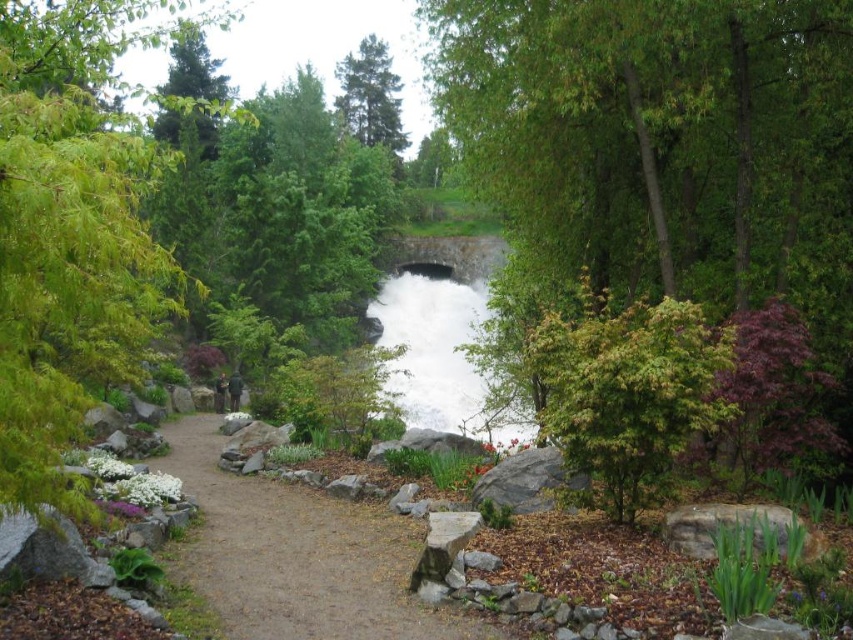
Does brown dirt path at center appear on the right side of green matte tree at upper left?

Indeed, brown dirt path at center is positioned on the right side of green matte tree at upper left.

Does point (248, 564) come farther from viewer compared to point (219, 92)?

No, (248, 564) is closer to viewer.

Find the location of a particular element. This screenshot has width=853, height=640. brown dirt path at center is located at coordinates (299, 556).

Consider the image. Which is more to the right, green leafy tree at left or brown dirt path at center?

Positioned to the right is brown dirt path at center.

Does green leafy tree at left appear over brown dirt path at center?

Yes, green leafy tree at left is above brown dirt path at center.

What do you see at coordinates (73, 230) in the screenshot?
I see `green leafy tree at left` at bounding box center [73, 230].

In order to click on green leafy tree at left in this screenshot , I will do `click(73, 230)`.

Consider the image. Who is taller, green leafy tree at center right or green matte tree at upper left?

green matte tree at upper left

Is the position of green leafy tree at center right more distant than that of green matte tree at upper left?

Yes.

This screenshot has width=853, height=640. Identify the location of green leafy tree at center right. (628, 390).